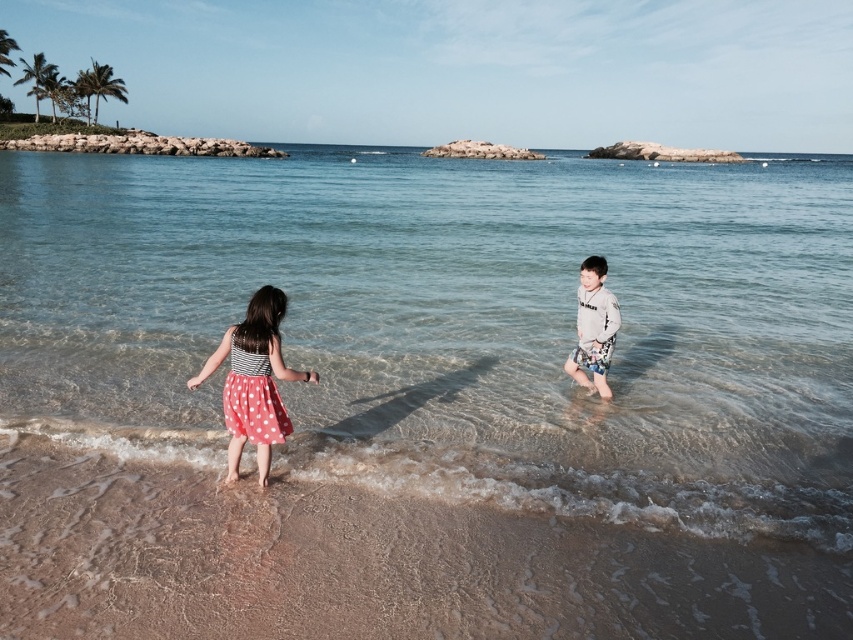
Measure the distance between brown sandy beach at lower center and light gray cotton shirt at center.

A distance of 3.15 meters exists between brown sandy beach at lower center and light gray cotton shirt at center.

Locate an element on the screen. The height and width of the screenshot is (640, 853). brown sandy beach at lower center is located at coordinates (366, 564).

Between clear water at center and light gray cotton shirt at center, which one appears on the right side from the viewer's perspective?

Positioned to the right is light gray cotton shirt at center.

Image resolution: width=853 pixels, height=640 pixels. Describe the element at coordinates (461, 321) in the screenshot. I see `clear water at center` at that location.

Is point (657, 387) farther from viewer compared to point (581, 298)?

That is True.

The height and width of the screenshot is (640, 853). Find the location of `clear water at center`. clear water at center is located at coordinates (461, 321).

Does brown sandy beach at lower center lie behind polka dot fabric dress at lower left?

No, it is in front of polka dot fabric dress at lower left.

Measure the distance between brown sandy beach at lower center and polka dot fabric dress at lower left.

4.32 feet

Does point (224, 524) come closer to viewer compared to point (268, 444)?

Yes, it is in front of point (268, 444).

Identify the location of brown sandy beach at lower center. (366, 564).